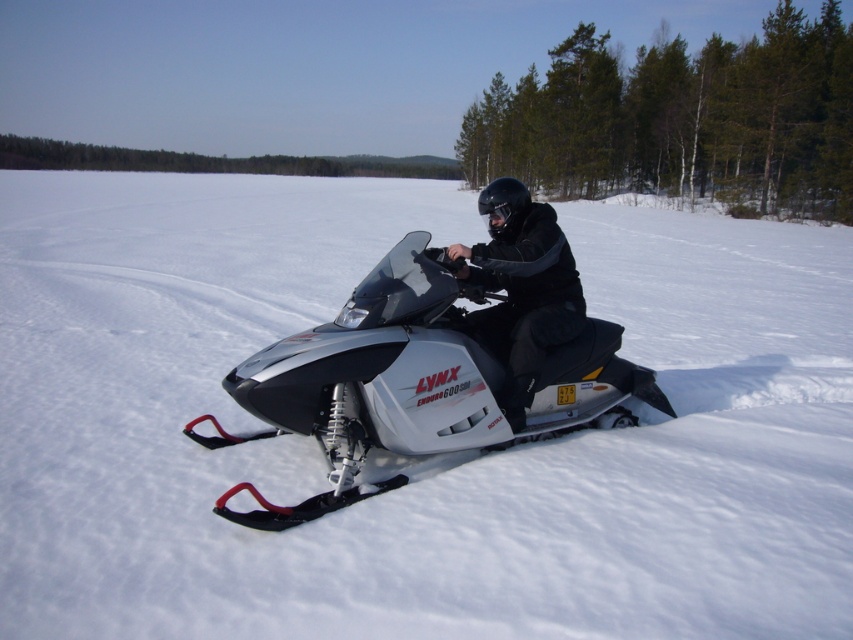
You are a photographer trying to capture the snowmobile rider. Since the white powdery snow at center and the black matte jacket at center are both in the frame, which one is covering the other?

The white powdery snow at center is positioned over the black matte jacket at center, so the snow is covering the jacket.

You are a drone operator trying to capture a photo of the white powdery snow at center and the silver metallic snowmobile at center. Your drone has a camera with a 100mm lens that can focus on objects within 5 meters. Can you capture both objects in focus using this lens?

The distance between the white powdery snow at center and the silver metallic snowmobile at center is 4.31 meters. Since the drone camera can focus within 5 meters, both objects are within the focus range and can be captured in focus.